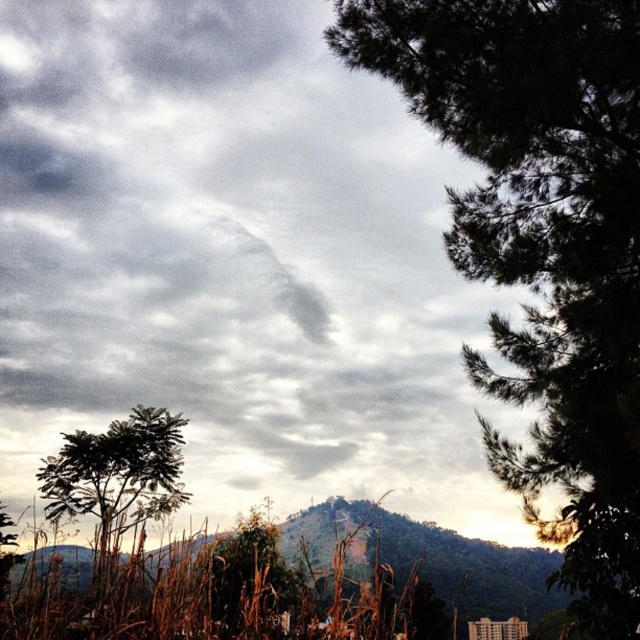
You are an environmental scientist examining the landscape. You observe the green textured hill at center and the green matte tree at lower center. Which object would cast a longer shadow during midday?

The green matte tree at lower center is taller than the green textured hill at center, so it would cast a longer shadow during midday.

You are standing in the landscape and want to walk from the green matte tree at lower center to the dark green textured tree at right. Which direction should you face to walk directly towards it?

You should face to the right direction since the dark green textured tree at right is located to the right of the green matte tree at lower center.